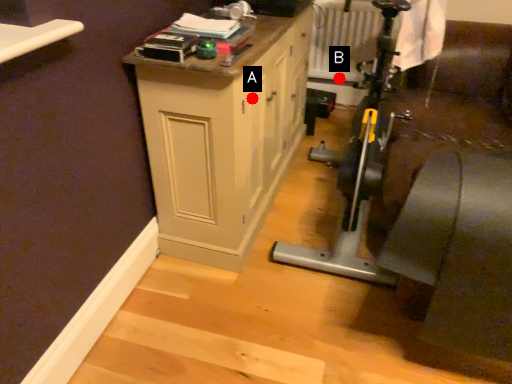
Question: Two points are circled on the image, labeled by A and B beside each circle. Which of the following is the farthest from the observer?

Choices:
 (A) A is further
 (B) B is further

Answer: (B)